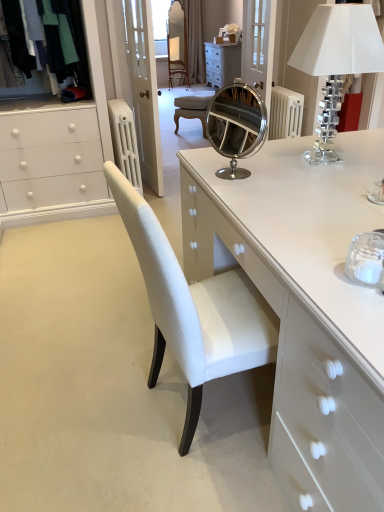
Question: Considering their positions, is white glossy chest of drawers at center located in front of or behind clear crystal lampshade at upper right?

Choices:
 (A) front
 (B) behind

Answer: (A)

Question: Is white glossy chest of drawers at center taller or shorter than clear crystal lampshade at upper right?

Choices:
 (A) short
 (B) tall

Answer: (A)

Question: Which of these objects is positioned closest to the white glossy chest of drawers at center?

Choices:
 (A) clear crystal lampshade at upper right
 (B) velvet fabric clothes at upper left
 (C) clear glass door at upper center
 (D) brown fabric curtain at upper center
 (E) white painted metal radiator at upper left

Answer: (A)

Question: Which of these objects is positioned farthest from the clear crystal lampshade at upper right?

Choices:
 (A) brown fabric curtain at upper center
 (B) white glossy chest of drawers at center
 (C) velvet fabric clothes at upper left
 (D) clear glass door at upper center
 (E) white painted metal radiator at upper left

Answer: (A)